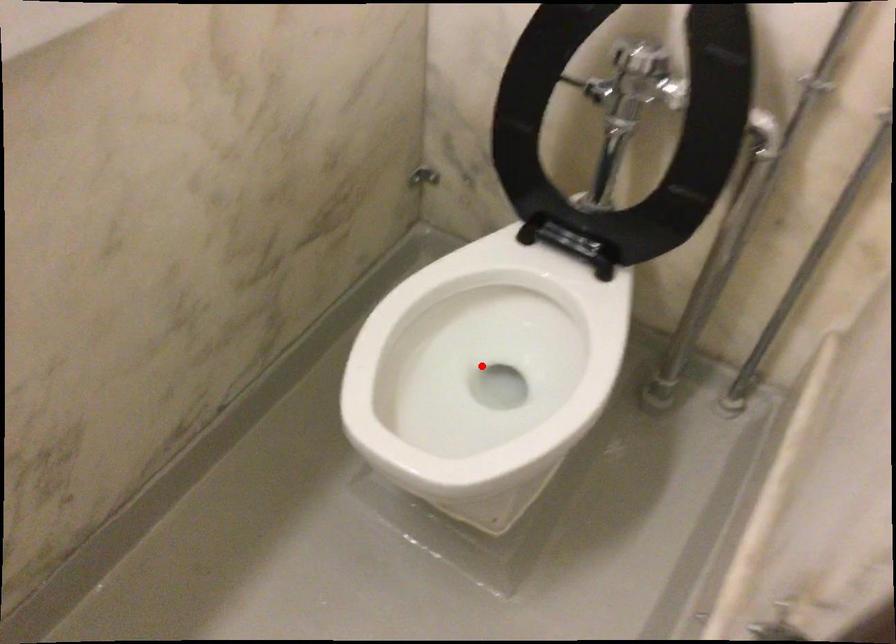
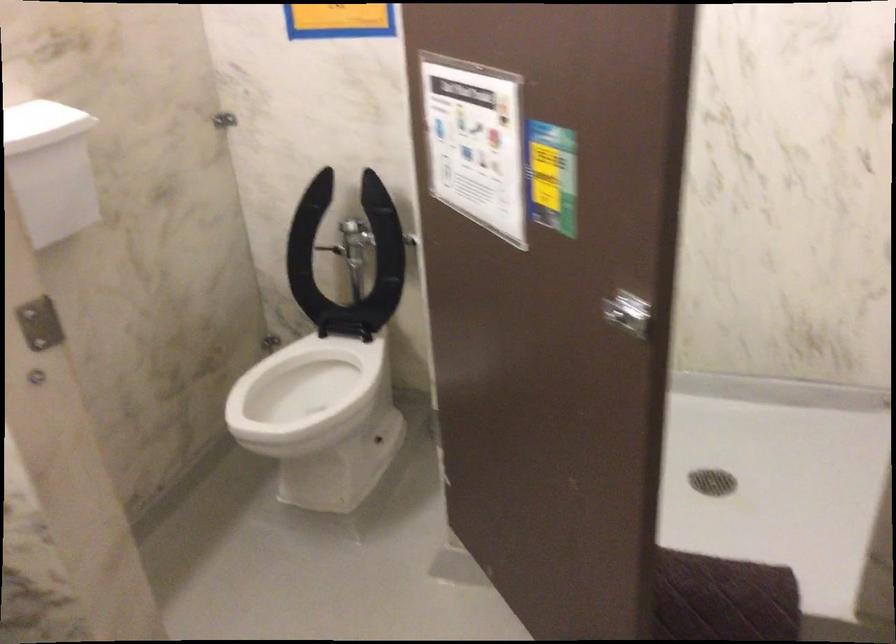
Question: I am providing you with two images of the same scene from different viewpoints. A red point is marked on the first image. Is the red point's position out of view in image 2?

Choices:
 (A) Yes
 (B) No

Answer: (A)